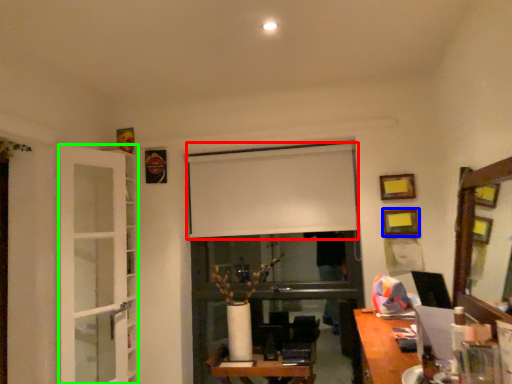
Question: Which object is the farthest from window screen (highlighted by a red box)? Choose among these: picture frame (highlighted by a blue box) or glass door (highlighted by a green box).

Choices:
 (A) picture frame
 (B) glass door

Answer: (B)